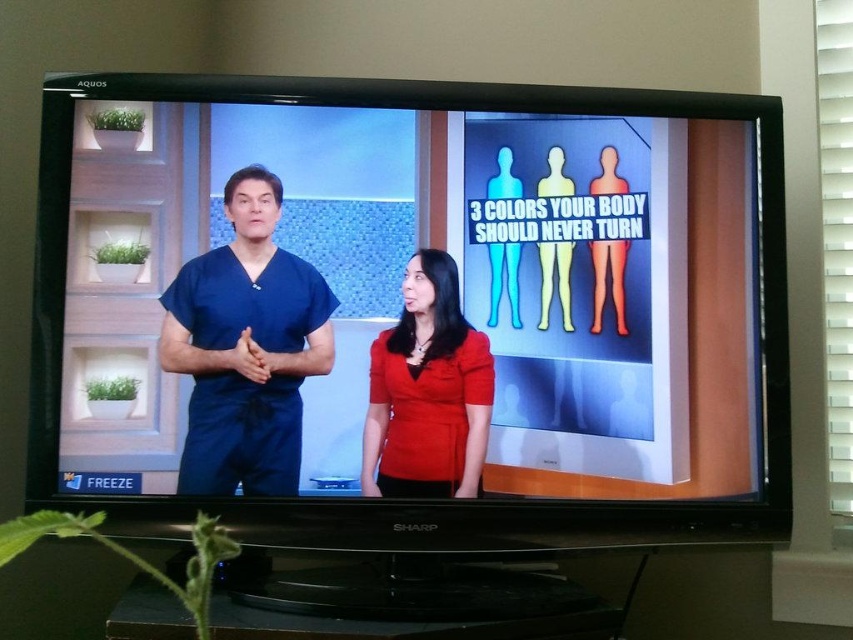
Question: Can you confirm if matte blue scrubs at center is positioned to the left of matte blue scrubs at left?

Choices:
 (A) yes
 (B) no

Answer: (B)

Question: Which of the following is the closest to the observer?

Choices:
 (A) matte blue scrubs at center
 (B) matte blue scrubs at left
 (C) matte red blouse at center

Answer: (A)

Question: Does matte blue scrubs at center appear on the left side of matte red blouse at center?

Choices:
 (A) no
 (B) yes

Answer: (B)

Question: Which point is closer to the camera?

Choices:
 (A) (412, 346)
 (B) (624, 115)
 (C) (270, 486)

Answer: (C)

Question: From the image, what is the correct spatial relationship of matte blue scrubs at center in relation to matte blue scrubs at left?

Choices:
 (A) left
 (B) right

Answer: (B)

Question: Which of the following is the closest to the observer?

Choices:
 (A) (554, 122)
 (B) (274, 461)
 (C) (379, 422)

Answer: (B)